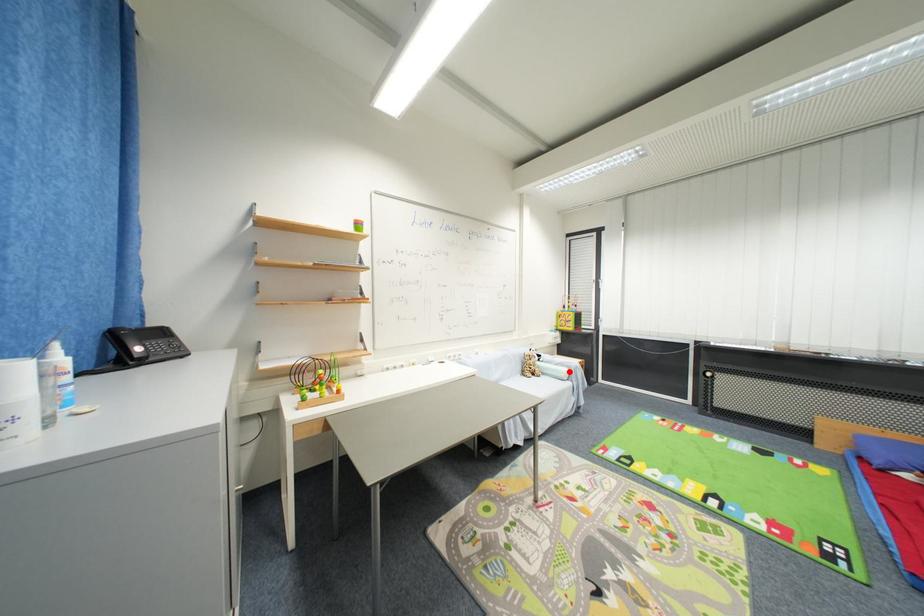
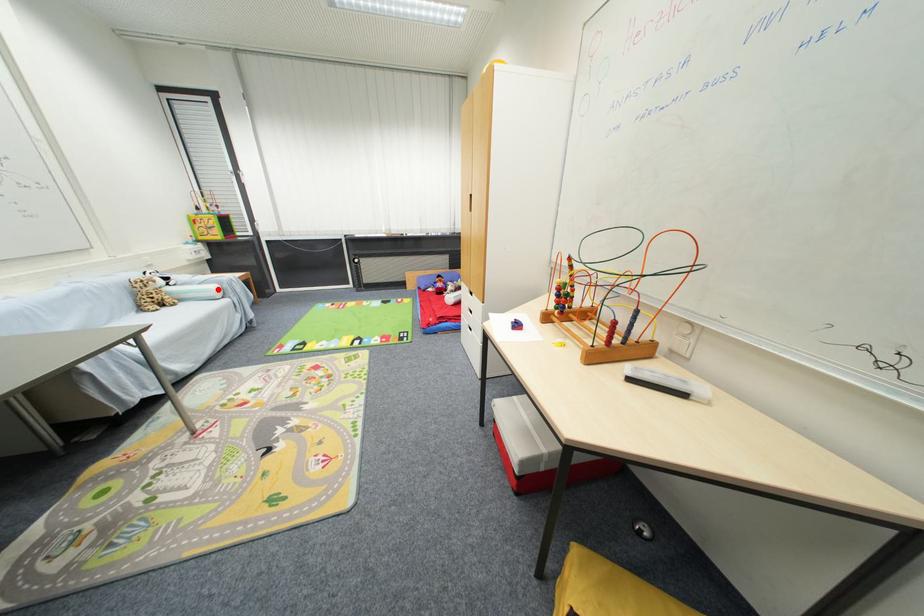
I am providing you with two images of the same scene from different viewpoints. A red point is marked on the first image and another point is marked on the second image. Do the highlighted points in image1 and image2 indicate the same real-world spot?

Yes